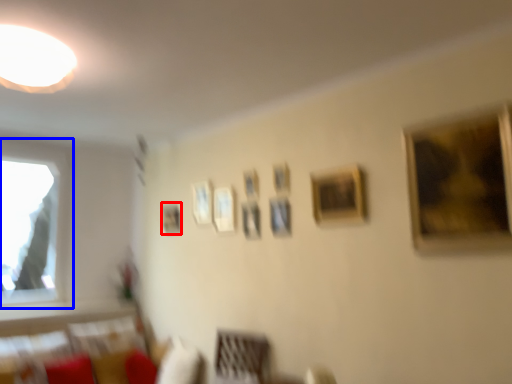
Question: Which of the following is the farthest to the observer, picture frame (highlighted by a red box) or window (highlighted by a blue box)?

Choices:
 (A) picture frame
 (B) window

Answer: (A)